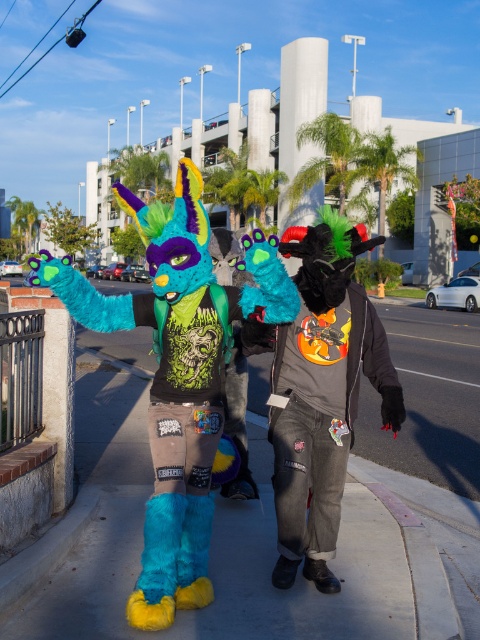
Which is below, fuzzy teal costume at center or fuzzy teal and black costume at center?

fuzzy teal and black costume at center is lower down.

Does fuzzy teal costume at center appear under fuzzy teal and black costume at center?

No.

Find the location of `fuzzy teal costume at center`. fuzzy teal costume at center is located at coordinates (180, 376).